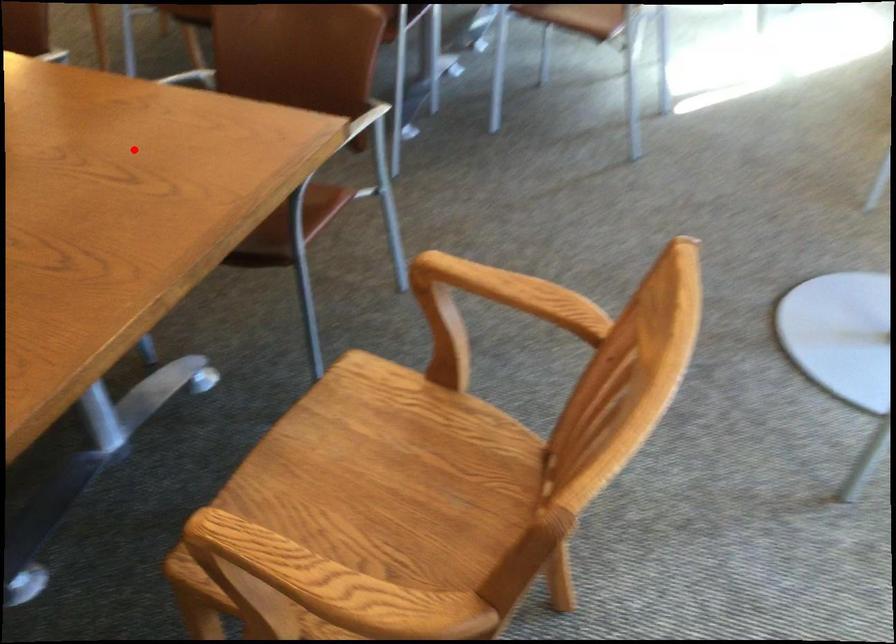
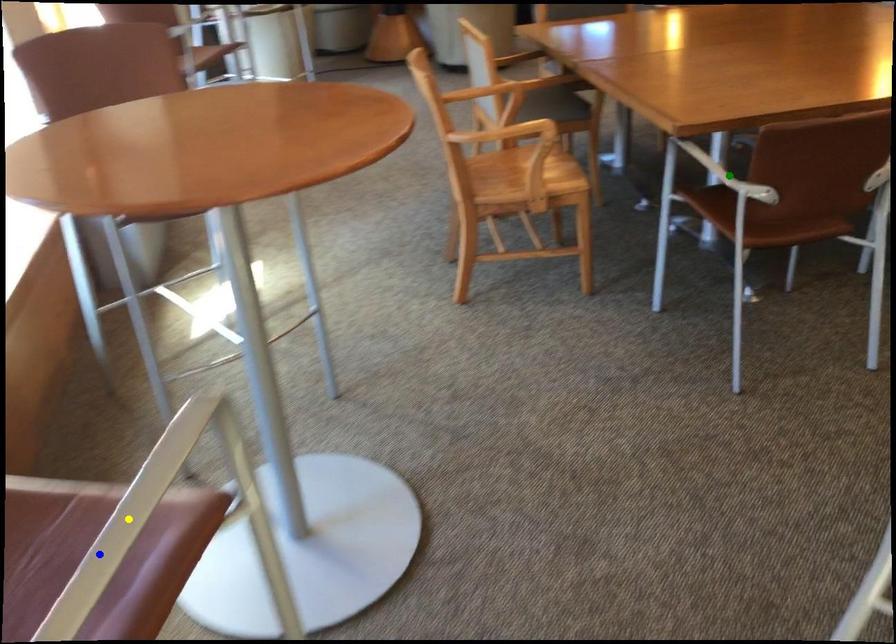
Question: I am providing you with two images of the same scene from different viewpoints. A red point is marked on the first image. You are given multiple points on the second image. Can you choose the point in image 2 that corresponds to the point in image 1?

Choices:
 (A) yellow point
 (B) green point
 (C) blue point

Answer: (B)